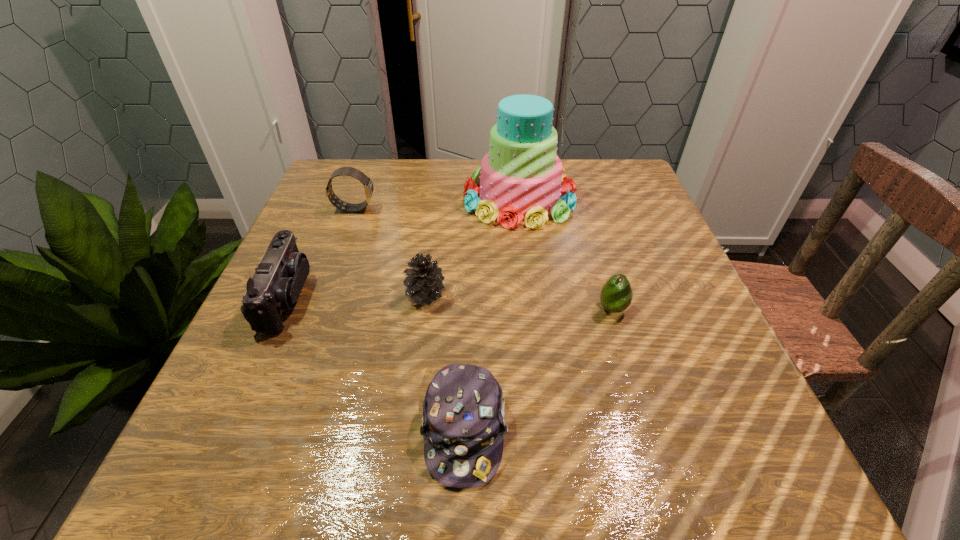
In the image, there is a desktop. What are the coordinates of `blank space at the left edge` in the screenshot? It's located at (338, 239).

The height and width of the screenshot is (540, 960). I want to click on blank area at the right edge, so point(736,397).

Locate an element on the screen. vacant point at the near left corner is located at coordinates [255, 464].

Identify the location of vacant space at the far right corner of the desktop. (605, 194).

I want to click on empty space that is in between the pinecone and the avocado, so click(x=519, y=302).

Locate an element on the screen. vacant area between the camcorder and the headwear is located at coordinates (375, 364).

I want to click on free space that is in between the watch and the nearest object, so click(409, 319).

Locate an element on the screen. free area in between the cake and the avocado is located at coordinates (565, 254).

Image resolution: width=960 pixels, height=540 pixels. What are the coordinates of `empty space between the tallest object and the camcorder` in the screenshot? It's located at (403, 248).

The image size is (960, 540). I want to click on free spot between the headwear and the watch, so click(409, 319).